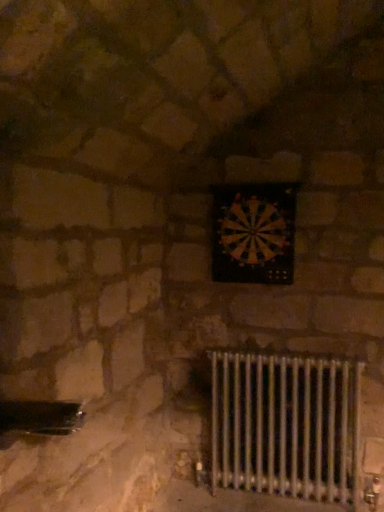
What do you see at coordinates (285, 425) in the screenshot? The height and width of the screenshot is (512, 384). I see `metallic silver radiator at lower right` at bounding box center [285, 425].

The height and width of the screenshot is (512, 384). In order to click on metallic silver radiator at lower right in this screenshot , I will do `click(285, 425)`.

The image size is (384, 512). Identify the location of metallic silver radiator at lower right. (285, 425).